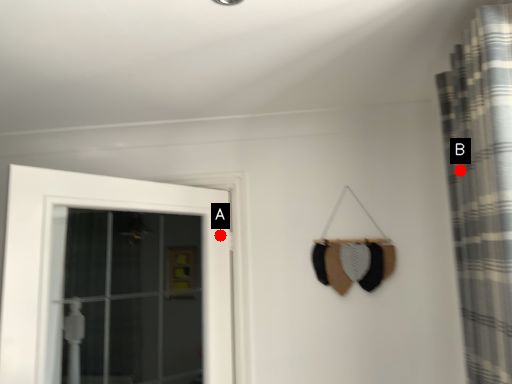
Question: Two points are circled on the image, labeled by A and B beside each circle. Which point appears farthest from the camera in this image?

Choices:
 (A) A is further
 (B) B is further

Answer: (A)